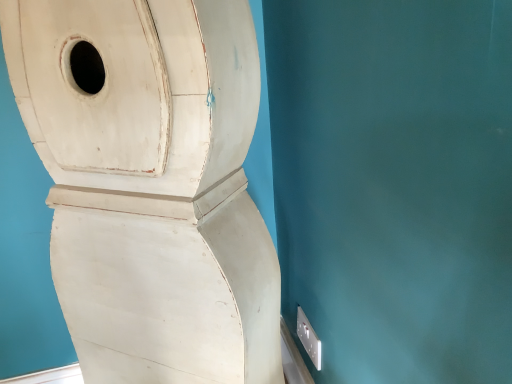
This screenshot has height=384, width=512. What do you see at coordinates (152, 186) in the screenshot?
I see `white matte toilet at center` at bounding box center [152, 186].

The image size is (512, 384). I want to click on white matte toilet at center, so click(152, 186).

In order to face white matte toilet at center, should I rotate leftwards or rightwards?

To face it directly, rotate left by 14.057 degrees.

I want to click on white matte toilet at center, so click(x=152, y=186).